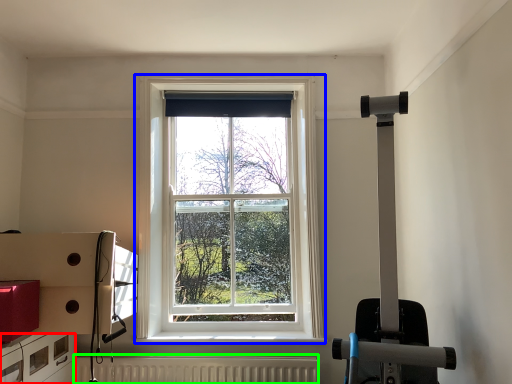
Question: Estimate the real-world distances between objects in this image. Which object is farther from drawer (highlighted by a red box), window (highlighted by a blue box) or radiator (highlighted by a green box)?

Choices:
 (A) window
 (B) radiator

Answer: (A)